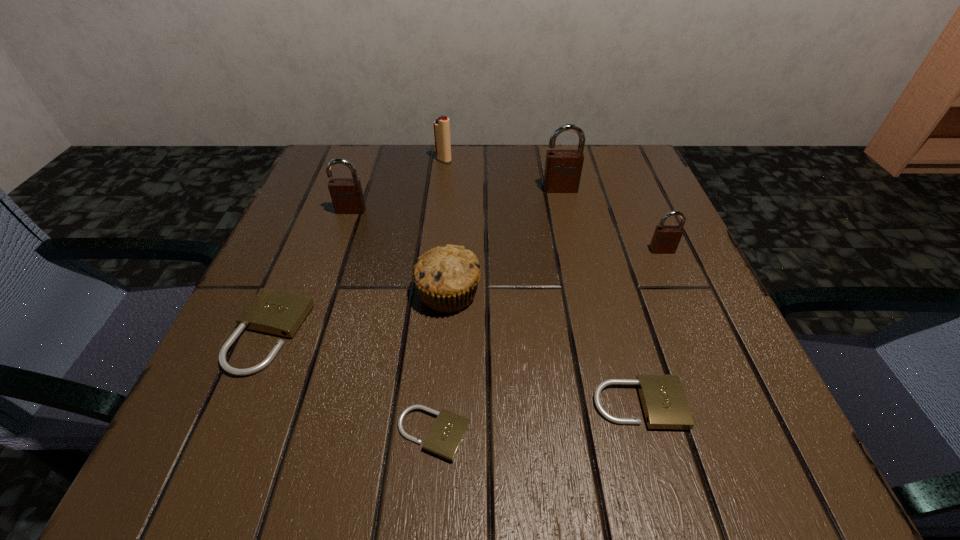
You are a GUI agent. You are given a task and a screenshot of the screen. Output one action in this format:
    pyautogui.click(x=<x>, y=<y>)
    Task: Click on the farthest beige padlock
    
    Given the screenshot: What is the action you would take?
    pyautogui.click(x=274, y=312)

Where is `the fifth tallest padlock`? This screenshot has width=960, height=540. the fifth tallest padlock is located at coordinates (663, 400).

At what (x,y) coordinates should I click in order to perform the action: click on the seventh tallest object. Please return your answer as a coordinate pair (x, y). The image size is (960, 540). Looking at the image, I should click on (663, 400).

This screenshot has height=540, width=960. Find the location of `the second beige padlock from right to left`. the second beige padlock from right to left is located at coordinates click(x=447, y=433).

Where is `the shortest object`? The width and height of the screenshot is (960, 540). the shortest object is located at coordinates (447, 433).

Identify the location of vacant space situated 0.380m on the front-facing side of the farthest padlock. (593, 333).

What are the coordinates of `free space located on the front-facing side of the second smallest brown padlock` in the screenshot? It's located at (324, 288).

Where is `vacant space located 0.190m on the right of the farthest object`? vacant space located 0.190m on the right of the farthest object is located at coordinates (532, 160).

The image size is (960, 540). Find the location of `vacant area situated 0.150m on the back of the muffin`. vacant area situated 0.150m on the back of the muffin is located at coordinates (453, 219).

In order to click on free space located 0.380m on the front-facing side of the rightmost brown padlock in this screenshot , I will do click(x=753, y=458).